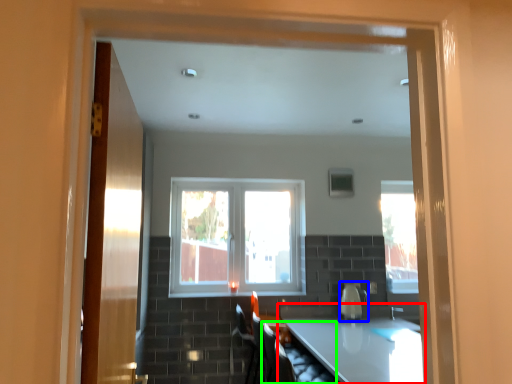
Question: Which object is positioned closest to countertop (highlighted by a red box)? Select from appliance (highlighted by a blue box) and armchair (highlighted by a green box).

Choices:
 (A) appliance
 (B) armchair

Answer: (B)